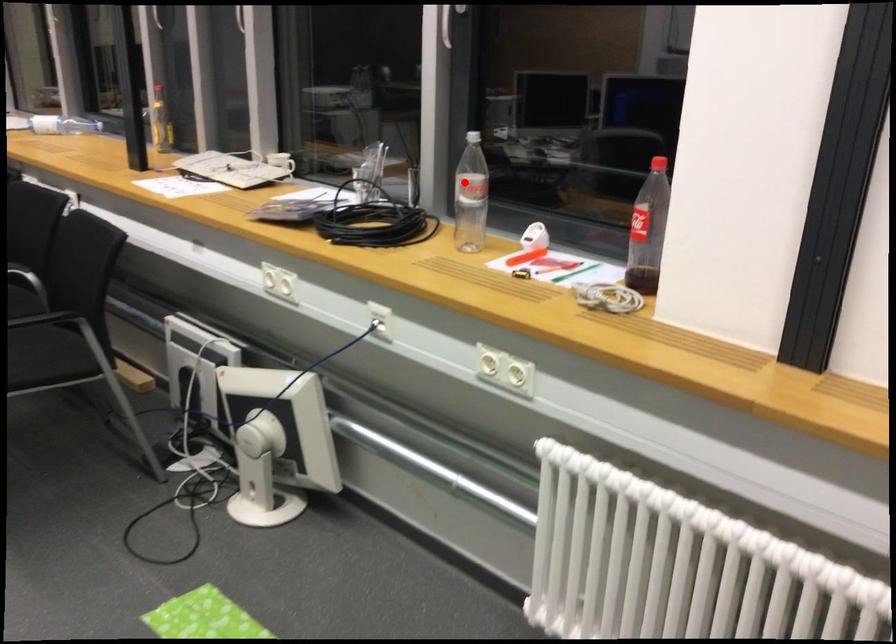
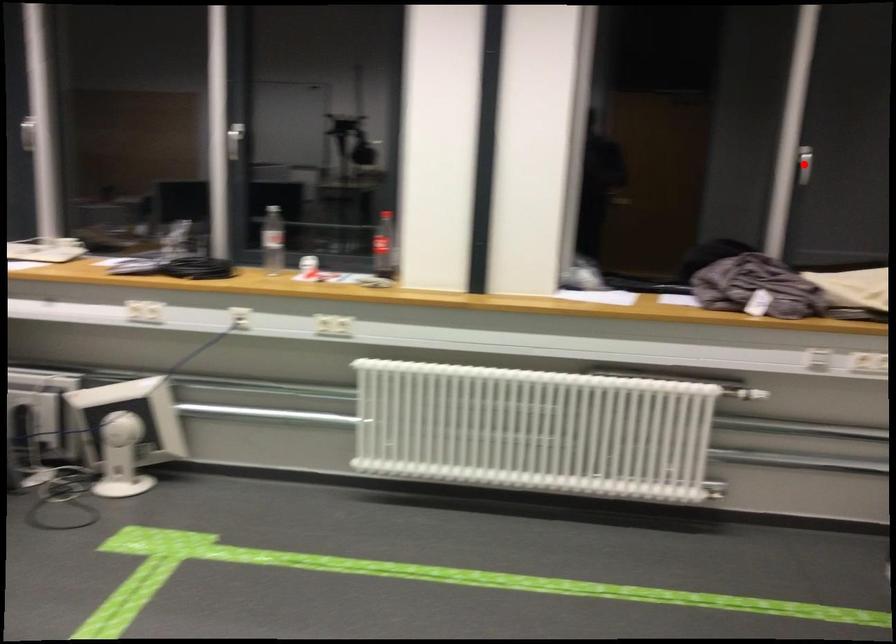
I am providing you with two images of the same scene from different viewpoints. A red point is marked on the first image and another point is marked on the second image. Does the point marked in image1 correspond to the same location as the one in image2?

No